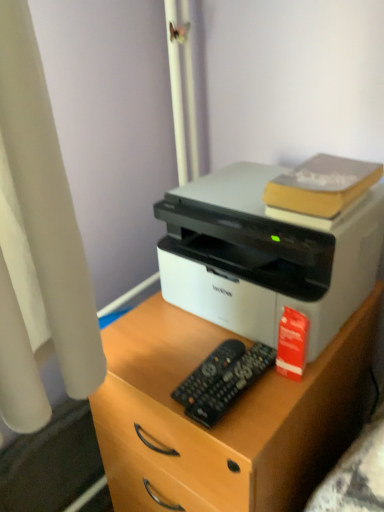
Find the location of a particular element. The width and height of the screenshot is (384, 512). vacant space to the left of black plastic remote at center, which is the second control from front to back is located at coordinates (150, 366).